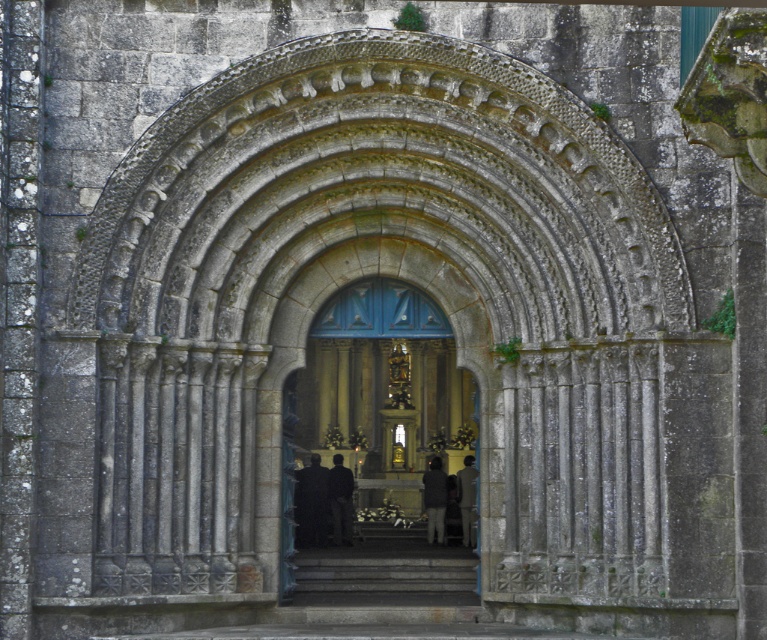
Does gray stone stairs at center appear on the right side of dark fabric coat at center?

Indeed, gray stone stairs at center is positioned on the right side of dark fabric coat at center.

Is gray stone stairs at center further to camera compared to dark fabric coat at center?

No.

Where is `gray stone stairs at center`? The image size is (767, 640). gray stone stairs at center is located at coordinates (384, 570).

Which is behind, point (351, 499) or point (430, 518)?

Point (430, 518)

Consider the image. Between dark fabric coat at center and dark gray fabric coat at center, which one appears on the left side from the viewer's perspective?

From the viewer's perspective, dark fabric coat at center appears more on the left side.

What do you see at coordinates (341, 500) in the screenshot? I see `dark fabric coat at center` at bounding box center [341, 500].

Where is `dark fabric coat at center`? The height and width of the screenshot is (640, 767). dark fabric coat at center is located at coordinates (341, 500).

Does gray stone stairs at center have a lesser width compared to dark brown leather coat at center?

Incorrect, gray stone stairs at center's width is not less than dark brown leather coat at center's.

From the picture: Is gray stone stairs at center in front of dark brown leather coat at center?

That is True.

The image size is (767, 640). Identify the location of gray stone stairs at center. (384, 570).